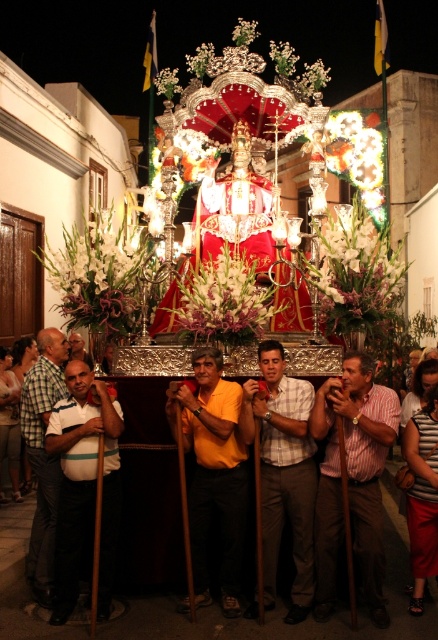
Question: Which of the following is the farthest from the observer?

Choices:
 (A) (353, 531)
 (B) (110, 488)

Answer: (B)

Question: From the image, what is the correct spatial relationship of white striped polo shirt at left in relation to orange fabric shirt at center?

Choices:
 (A) above
 (B) below

Answer: (B)

Question: Is orange fabric shirt at center behind yellow t-shirt at left?

Choices:
 (A) no
 (B) yes

Answer: (A)

Question: Can you confirm if plaid shirt at center is wider than white striped polo shirt at left?

Choices:
 (A) yes
 (B) no

Answer: (B)

Question: Which point is farther to the camera?

Choices:
 (A) (303, 408)
 (B) (28, 384)
 (C) (356, 531)
 (D) (74, 332)

Answer: (D)

Question: Among these objects, which one is farthest from the camera?

Choices:
 (A) yellow t-shirt at center
 (B) plaid shirt at center
 (C) yellow t-shirt at left
 (D) striped cotton shirt at center

Answer: (A)